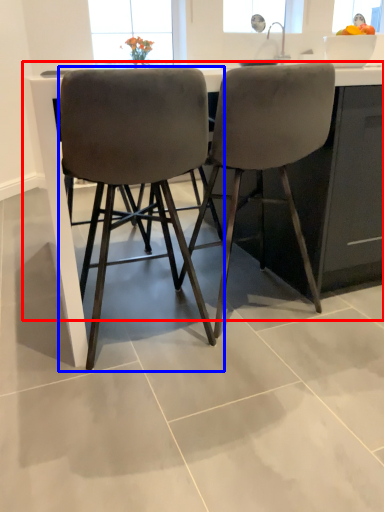
Question: Which of the following is the closest to the observer, counter (highlighted by a red box) or chair (highlighted by a blue box)?

Choices:
 (A) counter
 (B) chair

Answer: (B)